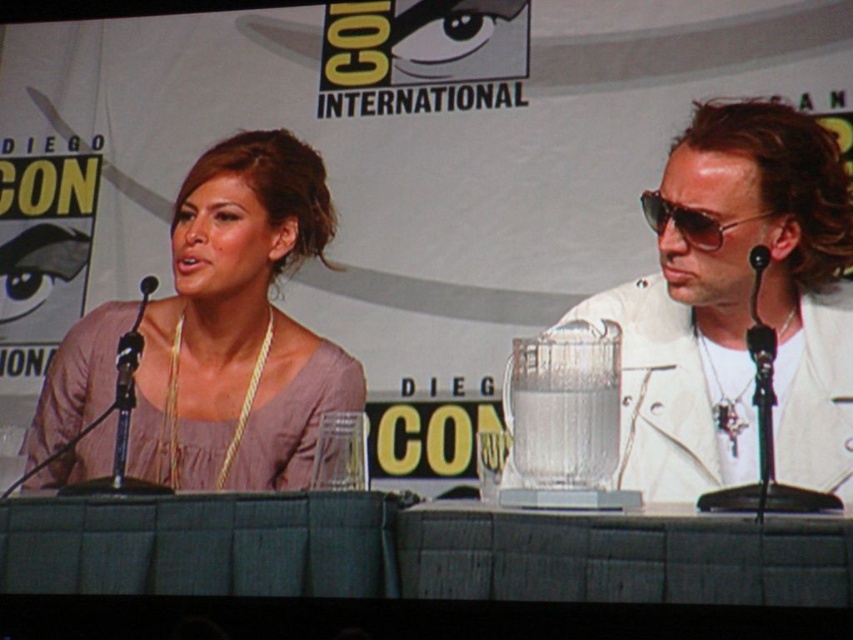
Question: Is the position of matte pink blouse at left more distant than that of sunglasses at right?

Choices:
 (A) yes
 (B) no

Answer: (A)

Question: From the image, what is the correct spatial relationship of matte pink blouse at left in relation to sunglasses at right?

Choices:
 (A) right
 (B) left

Answer: (B)

Question: Which of the following is the farthest from the observer?

Choices:
 (A) (299, 260)
 (B) (656, 221)

Answer: (A)

Question: Which object is positioned farthest from the sunglasses at right?

Choices:
 (A) white leather jacket at right
 (B) matte pink blouse at left

Answer: (B)

Question: Based on their relative distances, which object is farther from the matte pink blouse at left?

Choices:
 (A) white leather jacket at right
 (B) sunglasses at right

Answer: (B)

Question: Does matte pink blouse at left appear on the right side of sunglasses at right?

Choices:
 (A) yes
 (B) no

Answer: (B)